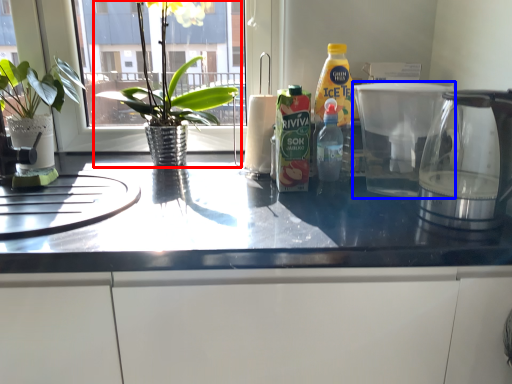
Question: Which object appears closest to the camera in this image, houseplant (highlighted by a red box) or coffeepot (highlighted by a blue box)?

Choices:
 (A) houseplant
 (B) coffeepot

Answer: (B)